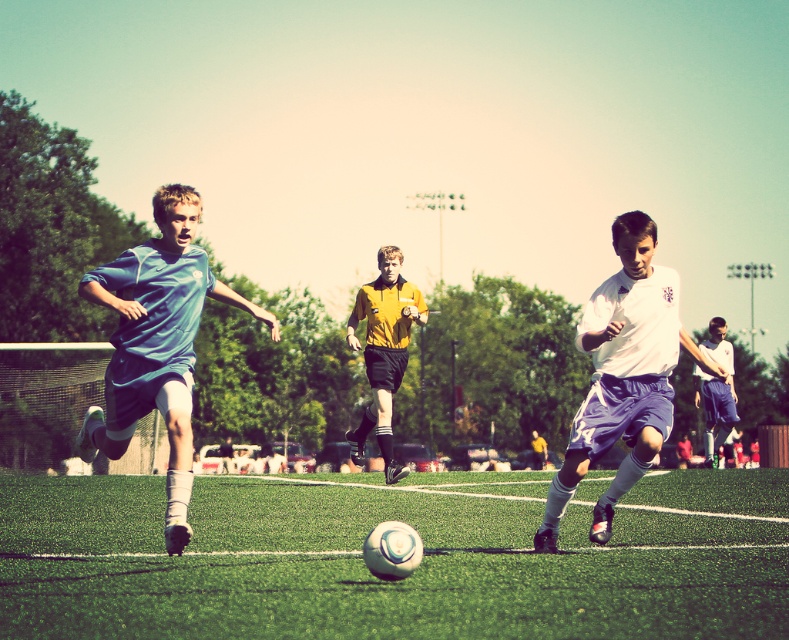
Question: Observing the image, what is the correct spatial positioning of matte blue jersey at center in reference to yellow matte shirt at center?

Choices:
 (A) right
 (B) left

Answer: (B)

Question: Which point is farther from the camera taking this photo?

Choices:
 (A) (182, 499)
 (B) (735, 625)
 (C) (716, 397)

Answer: (C)

Question: Does white matte soccer player at center have a greater width compared to white jersey at center?

Choices:
 (A) no
 (B) yes

Answer: (A)

Question: Can you confirm if matte blue jersey at center is bigger than yellow matte shirt at center?

Choices:
 (A) yes
 (B) no

Answer: (B)

Question: Which point is farther to the camera?

Choices:
 (A) matte blue jersey at center
 (B) white matte soccer player at center
 (C) yellow matte shirt at center

Answer: (C)

Question: Based on their relative distances, which object is nearer to the white matte soccer player at center?

Choices:
 (A) matte blue jersey at center
 (B) yellow matte shirt at center

Answer: (A)